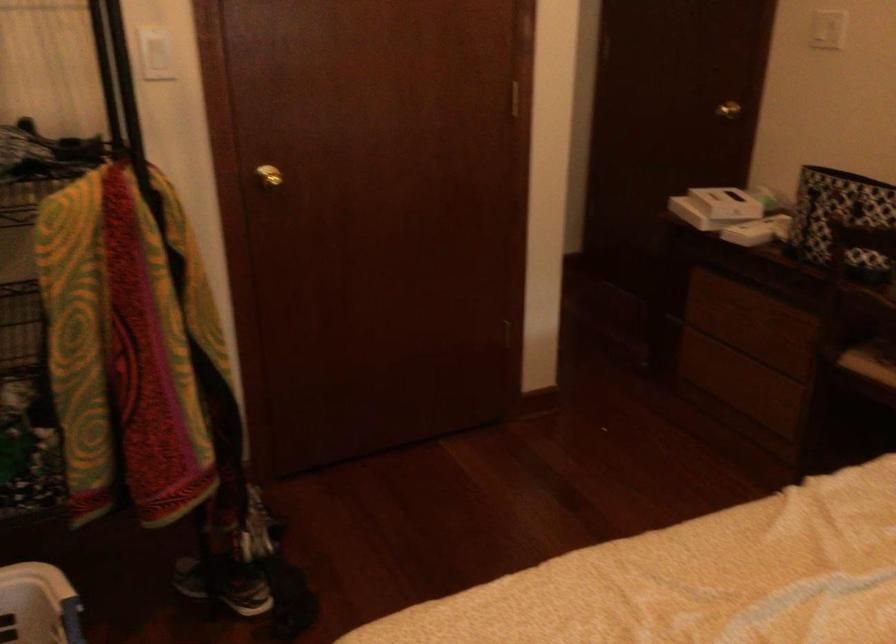
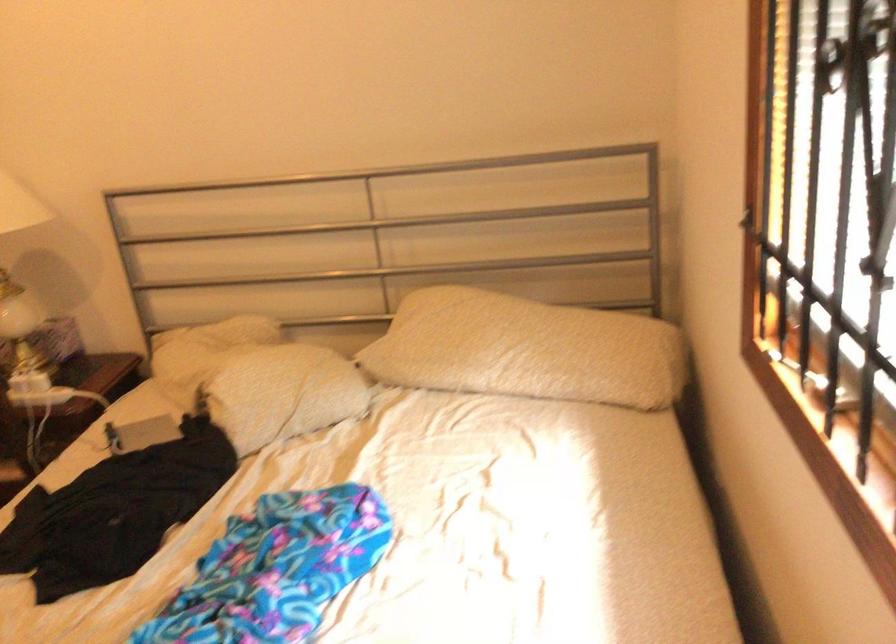
Question: The images are taken continuously from a first-person perspective. In which direction is your viewpoint rotating?

Choices:
 (A) Left
 (B) Right
 (C) Up
 (D) Down

Answer: (B)